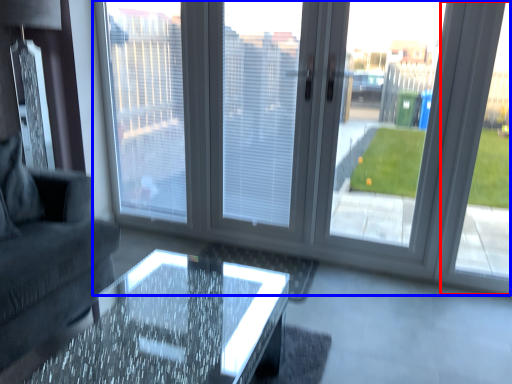
Question: Which point is closer to the camera, window frame (highlighted by a red box) or window (highlighted by a blue box)?

Choices:
 (A) window frame
 (B) window

Answer: (B)